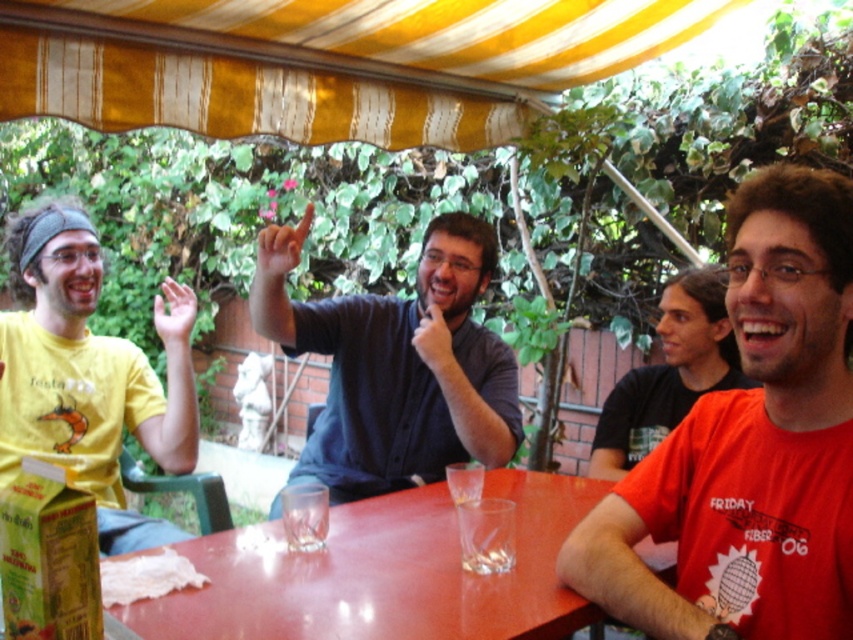
Question: Does smooth skin hand at upper left appear on the right side of matte black hand at center?

Choices:
 (A) no
 (B) yes

Answer: (A)

Question: Which point is farther to the camera?

Choices:
 (A) (70, 397)
 (B) (381, 474)
 (C) (373, 593)
 (D) (178, 305)

Answer: (B)

Question: Is red matte shirt at right further to camera compared to dark blue shirt at center?

Choices:
 (A) yes
 (B) no

Answer: (B)

Question: Can you confirm if smooth skin hand at upper left is wider than flesh-toned skin finger at center?

Choices:
 (A) no
 (B) yes

Answer: (A)

Question: Which point appears farthest from the camera in this image?

Choices:
 (A) (701, 477)
 (B) (688, 342)

Answer: (B)

Question: Considering the real-world distances, which object is farthest from the matte black shirt at center?

Choices:
 (A) smooth glossy wood table at center
 (B) red matte shirt at right
 (C) flesh-toned skin finger at center

Answer: (B)